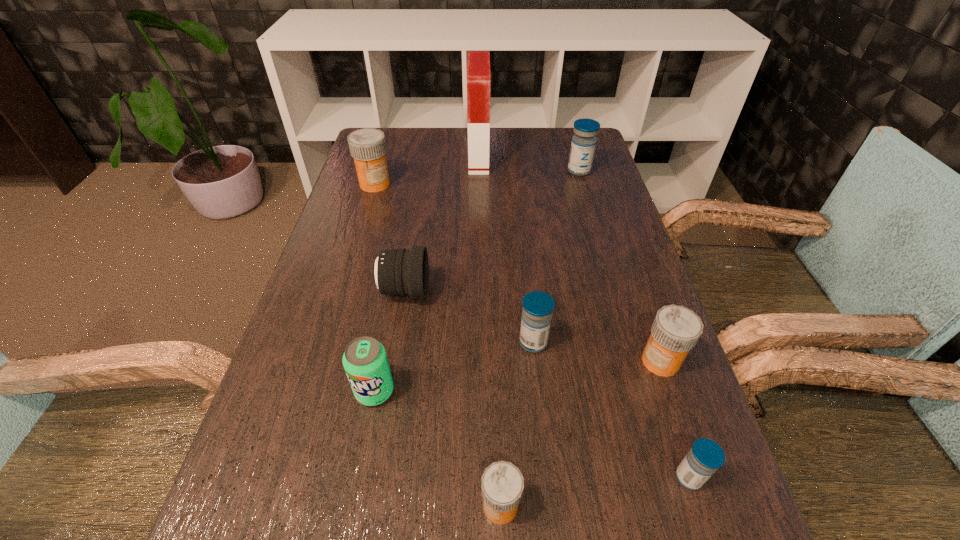
Identify the location of blank space located on the label side of the second farthest orange medicine. The width and height of the screenshot is (960, 540). (610, 361).

In order to click on vacant space located on the label side of the second farthest orange medicine in this screenshot , I will do `click(605, 361)`.

Image resolution: width=960 pixels, height=540 pixels. In order to click on vacant space positioned 0.390m on the label side of the second farthest orange medicine in this screenshot , I will do `click(440, 361)`.

Where is `free space located at the front element of the telephoto lens`? The width and height of the screenshot is (960, 540). free space located at the front element of the telephoto lens is located at coordinates (491, 291).

This screenshot has width=960, height=540. Identify the location of vacant space located on the left of the nearest blue medicine. (537, 477).

The height and width of the screenshot is (540, 960). Find the location of `free region located 0.290m on the label side of the fifth medicine from right to left`. free region located 0.290m on the label side of the fifth medicine from right to left is located at coordinates (291, 505).

At what (x,y) coordinates should I click in order to perform the action: click on free space located 0.340m on the label side of the fifth medicine from right to left. Please return your answer as a coordinate pair (x, y). The width and height of the screenshot is (960, 540). Looking at the image, I should click on (258, 505).

The width and height of the screenshot is (960, 540). In order to click on vacant region located 0.270m on the label side of the fifth medicine from right to left in this screenshot , I will do point(304,505).

Image resolution: width=960 pixels, height=540 pixels. I want to click on object that is at the far edge, so click(x=478, y=64).

The image size is (960, 540). In order to click on medicine at the left edge in this screenshot , I will do `click(367, 146)`.